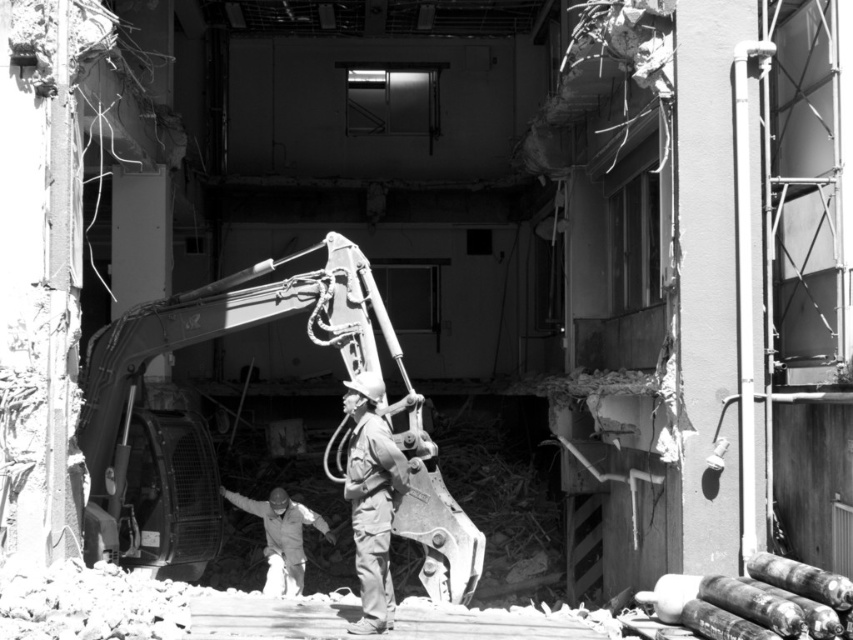
You are a safety inspector observing the demolition site. You notice the metallic gray excavator at center and the camouflage fabric uniform at center. Which object is taller?

The metallic gray excavator at center is taller than the camouflage fabric uniform at center.

You are standing at the entrance of the partially demolished building and want to reach the point marked at coordinates point (364, 516). If you can walk 1.5 meters per second, how long will it take you to reach that point?

The distance of point (364, 516) from viewer is 9.05 meters. At a walking speed of 1.5 meters per second, it would take approximately 6.03 seconds to reach the point.

You are standing at the entrance of the partially demolished building and want to locate two workers. The first worker is at point (392, 509) and the second worker is at point (300, 564). Which worker is closer to the entrance?

The worker at point (392, 509) is closer to the entrance because they are in front of the worker at point (300, 564).